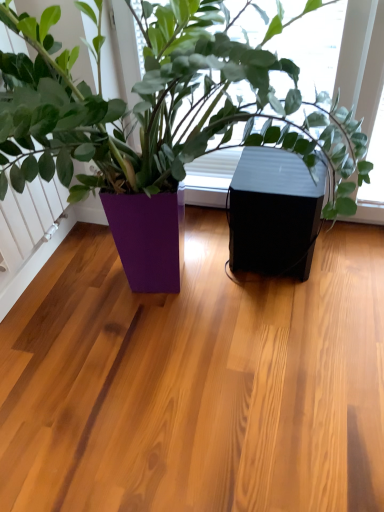
At what (x,y) coordinates should I click in order to perform the action: click on free spot to the right of black matte speaker at center. Please return your answer as a coordinate pair (x, y). Image resolution: width=384 pixels, height=512 pixels. Looking at the image, I should click on (349, 253).